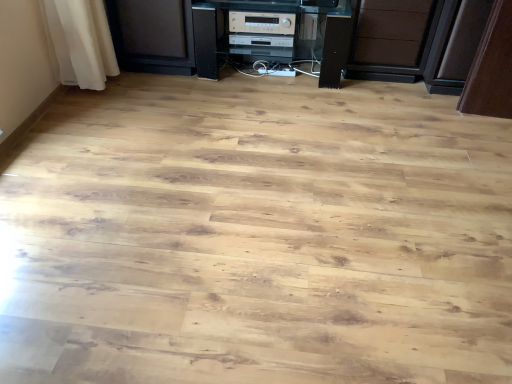
Question: Should I look upward or downward to see brown matte drawer at center?

Choices:
 (A) down
 (B) up

Answer: (B)

Question: Is black plastic stereo at center thinner than brown matte drawer at center?

Choices:
 (A) no
 (B) yes

Answer: (A)

Question: Is brown matte drawer at center completely or partially inside black plastic stereo at center?

Choices:
 (A) no
 (B) yes

Answer: (A)

Question: Is black plastic stereo at center oriented towards brown matte drawer at center?

Choices:
 (A) yes
 (B) no

Answer: (B)

Question: From a real-world perspective, does black plastic stereo at center sit lower than brown matte drawer at center?

Choices:
 (A) yes
 (B) no

Answer: (A)

Question: Does black plastic stereo at center have a lesser height compared to brown matte drawer at center?

Choices:
 (A) no
 (B) yes

Answer: (B)

Question: Does black plastic stereo at center appear on the left side of brown matte drawer at center?

Choices:
 (A) no
 (B) yes

Answer: (B)

Question: Considering the relative sizes of brown matte drawer at center and silver metallic stereo at center, positioned as the first appliance in back-to-front order, in the image provided, is brown matte drawer at center smaller than silver metallic stereo at center, positioned as the first appliance in back-to-front order,?

Choices:
 (A) yes
 (B) no

Answer: (B)

Question: Is brown matte drawer at center not near silver metallic stereo at center, positioned as the first appliance in back-to-front order?

Choices:
 (A) yes
 (B) no

Answer: (B)

Question: Considering the relative sizes of brown matte drawer at center and silver metallic stereo at center, the second appliance in the front-to-back sequence, in the image provided, is brown matte drawer at center bigger than silver metallic stereo at center, the second appliance in the front-to-back sequence,?

Choices:
 (A) yes
 (B) no

Answer: (A)

Question: From the image's perspective, is brown matte drawer at center located beneath silver metallic stereo at center, positioned as the first appliance in back-to-front order?

Choices:
 (A) yes
 (B) no

Answer: (A)

Question: Considering the relative positions of brown matte drawer at center and silver metallic stereo at center, positioned as the first appliance in back-to-front order, in the image provided, is brown matte drawer at center to the right of silver metallic stereo at center, positioned as the first appliance in back-to-front order, from the viewer's perspective?

Choices:
 (A) yes
 (B) no

Answer: (A)

Question: Is brown matte drawer at center positioned before silver metallic stereo at center, the second appliance in the front-to-back sequence?

Choices:
 (A) no
 (B) yes

Answer: (B)

Question: Can you confirm if silver metallic stereo at center, the second appliance viewed from the back, is shorter than brown matte drawer at center?

Choices:
 (A) yes
 (B) no

Answer: (A)